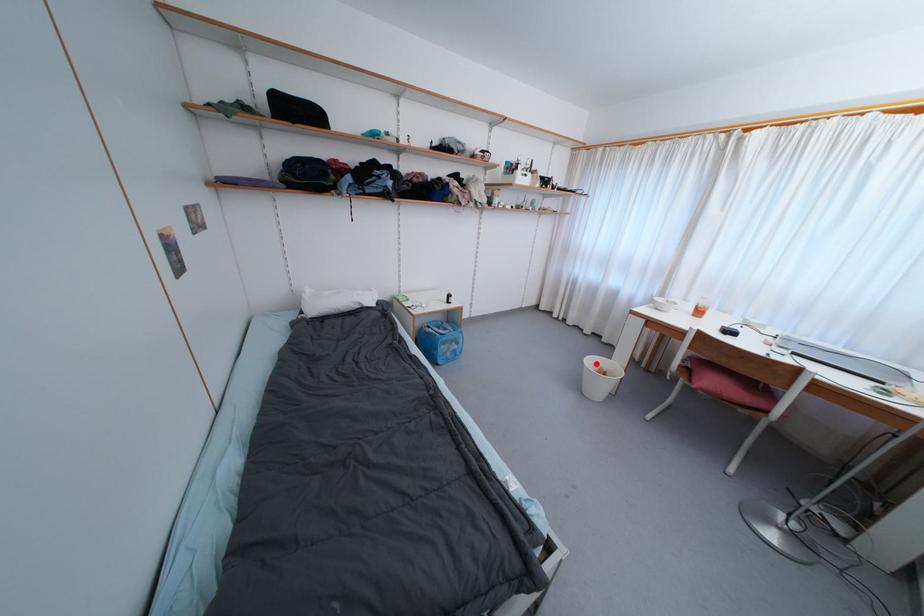
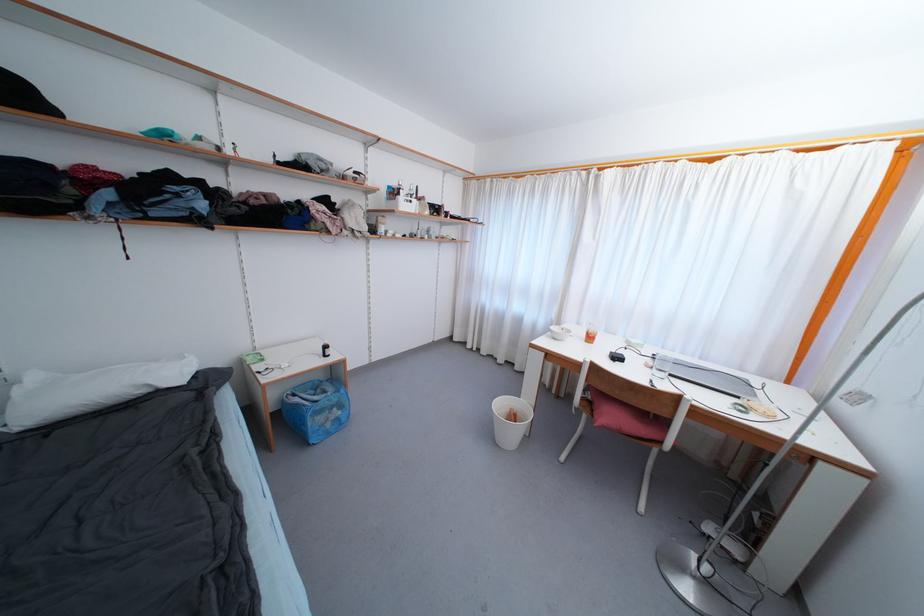
Locate, in the second image, the point that corresponds to the highlighted location in the first image.

(505, 407)